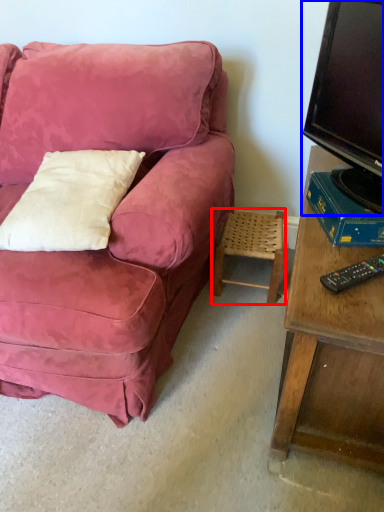
Question: Which point is further to the camera, stool (highlighted by a red box) or television (highlighted by a blue box)?

Choices:
 (A) stool
 (B) television

Answer: (A)